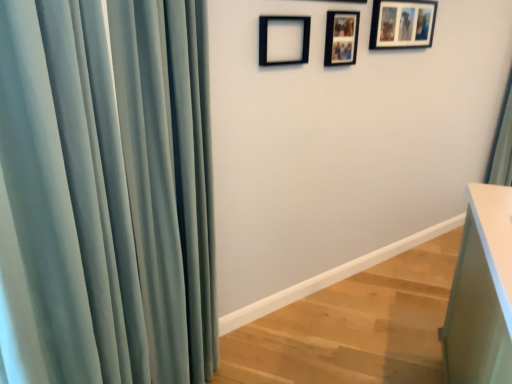
How much space does black matte picture frame at upper center, arranged as the third picture frame when viewed from the back, occupy horizontally?

black matte picture frame at upper center, arranged as the third picture frame when viewed from the back, is 1.62 inches wide.

What do you see at coordinates (105, 193) in the screenshot? The height and width of the screenshot is (384, 512). I see `satin teal curtain at left` at bounding box center [105, 193].

The image size is (512, 384). What do you see at coordinates (341, 38) in the screenshot?
I see `wooden photo frame at upper center, which is counted as the 2th picture frame, starting from the left` at bounding box center [341, 38].

Describe the element at coordinates (482, 292) in the screenshot. I see `white glossy vanity at lower right` at that location.

Find the location of a particular element. The image size is (512, 384). white glossy vanity at lower right is located at coordinates (482, 292).

Image resolution: width=512 pixels, height=384 pixels. Identify the location of matte black picture frame at upper right, which is the third picture frame in left-to-right order. [402, 24].

The width and height of the screenshot is (512, 384). I want to click on black matte picture frame at upper center, the first picture frame when ordered from left to right, so click(x=266, y=39).

Considering the positions of points (262, 54) and (174, 187), is point (262, 54) farther from camera compared to point (174, 187)?

Yes, it is.

Which is behind, black matte picture frame at upper center, positioned as the first picture frame in front-to-back order, or satin teal curtain at left?

Positioned behind is black matte picture frame at upper center, positioned as the first picture frame in front-to-back order.

From a real-world perspective, which object stands above the other?

From a 3D spatial view, black matte picture frame at upper center, the first picture frame when ordered from left to right, is above.

Is black matte picture frame at upper center, positioned as the first picture frame in front-to-back order, looking in the opposite direction of satin teal curtain at left?

No, satin teal curtain at left is not at the back of black matte picture frame at upper center, positioned as the first picture frame in front-to-back order.

From the image's perspective, is white glossy vanity at lower right located above matte black picture frame at upper right, which is the third picture frame in front-to-back order?

No, from the image's perspective, white glossy vanity at lower right is not above matte black picture frame at upper right, which is the third picture frame in front-to-back order.

In the scene shown: Is white glossy vanity at lower right not near matte black picture frame at upper right, which is the first picture frame from right to left?

Absolutely, white glossy vanity at lower right is distant from matte black picture frame at upper right, which is the first picture frame from right to left.

Is matte black picture frame at upper right, which is the third picture frame in left-to-right order, inside white glossy vanity at lower right?

No, white glossy vanity at lower right does not contain matte black picture frame at upper right, which is the third picture frame in left-to-right order.

Find the location of a particular element. This screenshot has width=512, height=384. picture frame that is the 3rd one above the white glossy vanity at lower right (from a real-world perspective) is located at coordinates (402, 24).

Between satin teal curtain at left and matte black picture frame at upper right, which is the third picture frame in front-to-back order, which one has larger width?

With larger width is satin teal curtain at left.

Between satin teal curtain at left and matte black picture frame at upper right, the first picture frame in the back-to-front sequence, which one appears on the left side from the viewer's perspective?

satin teal curtain at left is more to the left.

Is satin teal curtain at left in contact with matte black picture frame at upper right, the first picture frame in the back-to-front sequence?

They are not placed beside each other.

Does satin teal curtain at left turn towards matte black picture frame at upper right, the first picture frame in the back-to-front sequence?

No, satin teal curtain at left is not turned towards matte black picture frame at upper right, the first picture frame in the back-to-front sequence.

Is wooden photo frame at upper center, which is the 2th picture frame from front to back, shorter than white glossy vanity at lower right?

Yes, wooden photo frame at upper center, which is the 2th picture frame from front to back, is shorter than white glossy vanity at lower right.

In the scene shown: From the image's perspective, is wooden photo frame at upper center, the 2th picture frame viewed from the back, below white glossy vanity at lower right?

No, from the image's perspective, wooden photo frame at upper center, the 2th picture frame viewed from the back, is not below white glossy vanity at lower right.

From a real-world perspective, is wooden photo frame at upper center, which is counted as the 2th picture frame, starting from the left, physically below white glossy vanity at lower right?

No.

Could you tell me if wooden photo frame at upper center, the 2th picture frame viewed from the back, is facing matte black picture frame at upper right, which is the third picture frame in left-to-right order?

No, wooden photo frame at upper center, the 2th picture frame viewed from the back, is not oriented towards matte black picture frame at upper right, which is the third picture frame in left-to-right order.

Can you confirm if wooden photo frame at upper center, arranged as the 2th picture frame when viewed from the right, is positioned to the right of matte black picture frame at upper right, which is the first picture frame from right to left?

No.

Does wooden photo frame at upper center, the 2th picture frame viewed from the back, have a greater height compared to matte black picture frame at upper right, which is the third picture frame in front-to-back order?

Incorrect, the height of wooden photo frame at upper center, the 2th picture frame viewed from the back, is not larger of that of matte black picture frame at upper right, which is the third picture frame in front-to-back order.

From the image's perspective, is wooden photo frame at upper center, which is the 2th picture frame from front to back, beneath matte black picture frame at upper right, which is the third picture frame in left-to-right order?

Yes.

Between black matte picture frame at upper center, which ranks as the 3th picture frame in right-to-left order, and white glossy vanity at lower right, which one has smaller width?

With smaller width is black matte picture frame at upper center, which ranks as the 3th picture frame in right-to-left order.

Considering the points (303, 32) and (455, 361), which point is in front, point (303, 32) or point (455, 361)?

The point (455, 361) is more forward.

From a real-world perspective, is black matte picture frame at upper center, positioned as the first picture frame in front-to-back order, above or below white glossy vanity at lower right?

black matte picture frame at upper center, positioned as the first picture frame in front-to-back order, is situated higher than white glossy vanity at lower right in the real world.

In the image, is black matte picture frame at upper center, arranged as the third picture frame when viewed from the back, on the left side or the right side of white glossy vanity at lower right?

Clearly, black matte picture frame at upper center, arranged as the third picture frame when viewed from the back, is on the left of white glossy vanity at lower right in the image.

From the image's perspective, between satin teal curtain at left and black matte picture frame at upper center, the first picture frame when ordered from left to right, who is located below?

From the image's view, satin teal curtain at left is below.

Considering their positions, is satin teal curtain at left located in front of or behind black matte picture frame at upper center, which ranks as the 3th picture frame in right-to-left order?

Visually, satin teal curtain at left is located in front of black matte picture frame at upper center, which ranks as the 3th picture frame in right-to-left order.

Considering the relative positions of satin teal curtain at left and black matte picture frame at upper center, positioned as the first picture frame in front-to-back order, in the image provided, is satin teal curtain at left to the right of black matte picture frame at upper center, positioned as the first picture frame in front-to-back order, from the viewer's perspective?

No.

Identify the location of curtain lying in front of the black matte picture frame at upper center, the first picture frame when ordered from left to right. (105, 193).

This screenshot has width=512, height=384. Find the location of `the 1st picture frame above the satin teal curtain at left (from the image's perspective)`. the 1st picture frame above the satin teal curtain at left (from the image's perspective) is located at coordinates (266, 39).

At what (x,y) coordinates should I click in order to perform the action: click on vanity below the matte black picture frame at upper right, which is the third picture frame in front-to-back order (from a real-world perspective). Please return your answer as a coordinate pair (x, y). The width and height of the screenshot is (512, 384). Looking at the image, I should click on tap(482, 292).

Looking at the image, which one is located further to wooden photo frame at upper center, which is the 2th picture frame from front to back, matte black picture frame at upper right, which is the first picture frame from right to left, or white glossy vanity at lower right?

white glossy vanity at lower right is further to wooden photo frame at upper center, which is the 2th picture frame from front to back.

Which object lies further to the anchor point matte black picture frame at upper right, which is the first picture frame from right to left, wooden photo frame at upper center, the 2th picture frame viewed from the back, or satin teal curtain at left?

Based on the image, satin teal curtain at left appears to be further to matte black picture frame at upper right, which is the first picture frame from right to left.

When comparing their distances from white glossy vanity at lower right, does satin teal curtain at left or wooden photo frame at upper center, which is counted as the 2th picture frame, starting from the left, seem further?

The object further to white glossy vanity at lower right is wooden photo frame at upper center, which is counted as the 2th picture frame, starting from the left.

Looking at this image, looking at the image, which one is located further to black matte picture frame at upper center, arranged as the third picture frame when viewed from the back, matte black picture frame at upper right, which is the third picture frame in left-to-right order, or wooden photo frame at upper center, which is the 2th picture frame from front to back?

matte black picture frame at upper right, which is the third picture frame in left-to-right order, is positioned further to the anchor black matte picture frame at upper center, arranged as the third picture frame when viewed from the back.

When comparing their distances from matte black picture frame at upper right, the first picture frame in the back-to-front sequence, does black matte picture frame at upper center, positioned as the first picture frame in front-to-back order, or wooden photo frame at upper center, the 2th picture frame viewed from the back, seem closer?

Based on the image, wooden photo frame at upper center, the 2th picture frame viewed from the back, appears to be nearer to matte black picture frame at upper right, the first picture frame in the back-to-front sequence.

Which object lies further to the anchor point white glossy vanity at lower right, matte black picture frame at upper right, which is the third picture frame in left-to-right order, or black matte picture frame at upper center, the first picture frame when ordered from left to right?

The object further to white glossy vanity at lower right is matte black picture frame at upper right, which is the third picture frame in left-to-right order.

Looking at the image, which one is located closer to white glossy vanity at lower right, black matte picture frame at upper center, which ranks as the 3th picture frame in right-to-left order, or wooden photo frame at upper center, which is the 2th picture frame from front to back?

wooden photo frame at upper center, which is the 2th picture frame from front to back.

Considering their positions, is black matte picture frame at upper center, positioned as the first picture frame in front-to-back order, positioned closer to wooden photo frame at upper center, which is the 2th picture frame from front to back, than white glossy vanity at lower right?

Among the two, black matte picture frame at upper center, positioned as the first picture frame in front-to-back order, is located nearer to wooden photo frame at upper center, which is the 2th picture frame from front to back.

Where is `picture frame between black matte picture frame at upper center, which ranks as the 3th picture frame in right-to-left order, and matte black picture frame at upper right, which is the first picture frame from right to left`? picture frame between black matte picture frame at upper center, which ranks as the 3th picture frame in right-to-left order, and matte black picture frame at upper right, which is the first picture frame from right to left is located at coordinates (341, 38).

This screenshot has width=512, height=384. What are the coordinates of `vanity between satin teal curtain at left and black matte picture frame at upper center, the first picture frame when ordered from left to right, in the front-back direction` in the screenshot? It's located at (482, 292).

Where is `vanity between satin teal curtain at left and wooden photo frame at upper center, arranged as the 2th picture frame when viewed from the right, from front to back`? vanity between satin teal curtain at left and wooden photo frame at upper center, arranged as the 2th picture frame when viewed from the right, from front to back is located at coordinates (482, 292).

You are a GUI agent. You are given a task and a screenshot of the screen. Output one action in this format:
    pyautogui.click(x=<x>, y=<y>)
    Task: Click on the vanity between satin teal curtain at left and matte black picture frame at upper right, which is the first picture frame from right to left, along the z-axis
    Image resolution: width=512 pixels, height=384 pixels.
    Given the screenshot: What is the action you would take?
    pyautogui.click(x=482, y=292)